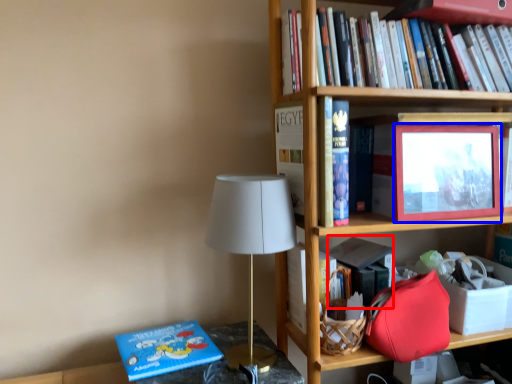
Question: Which of the following is the closest to the observer, paperback book (highlighted by a red box) or picture frame (highlighted by a blue box)?

Choices:
 (A) paperback book
 (B) picture frame

Answer: (B)